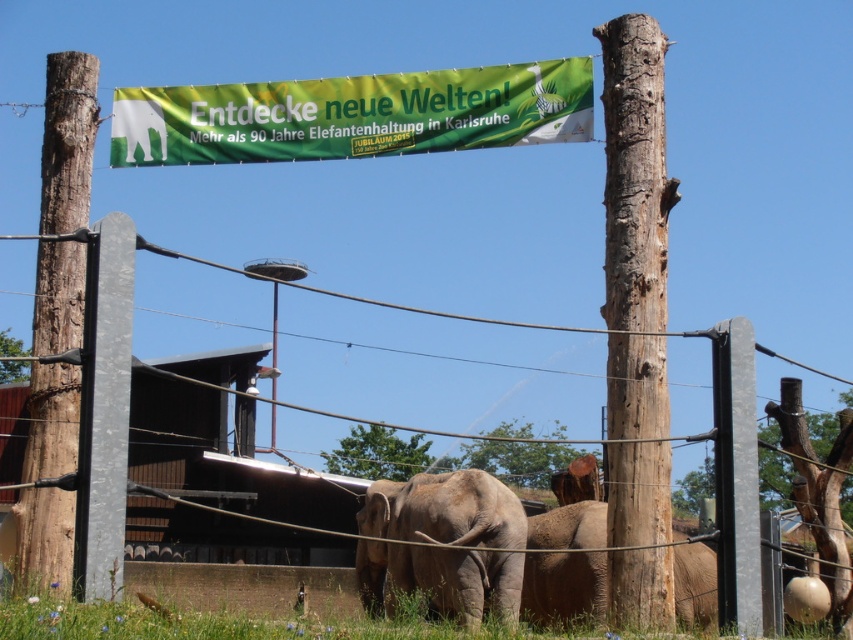
Question: Which object is farther from the camera taking this photo?

Choices:
 (A) brown rough wood pole at left
 (B) gray matte elephant at lower right

Answer: (B)

Question: Does green fabric banner at upper center have a smaller size compared to gray matte elephant at lower right?

Choices:
 (A) yes
 (B) no

Answer: (B)

Question: Considering the real-world distances, which object is closest to the green fabric banner at upper center?

Choices:
 (A) brown rough wood pole at left
 (B) gray matte elephant at center

Answer: (A)

Question: Does metal wire fence at center appear under green grass at lower center?

Choices:
 (A) no
 (B) yes

Answer: (A)

Question: Is smooth brown wood at right thinner than gray matte elephant at center?

Choices:
 (A) yes
 (B) no

Answer: (A)

Question: Which object is closer to the camera taking this photo?

Choices:
 (A) gray matte elephant at center
 (B) smooth brown wood at right

Answer: (B)